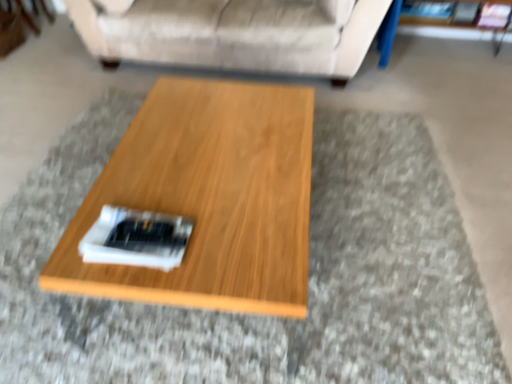
Find the location of a particular element. This screenshot has height=384, width=512. wooden coffee table at center is located at coordinates (208, 199).

What do you see at coordinates (208, 199) in the screenshot? I see `wooden coffee table at center` at bounding box center [208, 199].

In order to face wooden coffee table at center, should I rotate leftwards or rightwards?

Turn left by 5.314 degrees to look at wooden coffee table at center.

The image size is (512, 384). What do you see at coordinates (234, 34) in the screenshot?
I see `beige fabric couch at upper center` at bounding box center [234, 34].

Where is `beige fabric couch at upper center`? beige fabric couch at upper center is located at coordinates pyautogui.click(x=234, y=34).

Where is `wooden coffee table at center`? The width and height of the screenshot is (512, 384). wooden coffee table at center is located at coordinates (208, 199).

Consider the image. Is beige fabric couch at upper center at the right side of wooden coffee table at center?

Incorrect, beige fabric couch at upper center is not on the right side of wooden coffee table at center.

In the image, is beige fabric couch at upper center positioned in front of or behind wooden coffee table at center?

beige fabric couch at upper center is behind wooden coffee table at center.

Which point is more distant from viewer, (100, 13) or (62, 261)?

The point (100, 13) is behind.

From the image's perspective, would you say beige fabric couch at upper center is positioned over wooden coffee table at center?

Yes, from the image's perspective, beige fabric couch at upper center is above wooden coffee table at center.

From a real-world perspective, does beige fabric couch at upper center stand above wooden coffee table at center?

Indeed, from a real-world perspective, beige fabric couch at upper center stands above wooden coffee table at center.

Between beige fabric couch at upper center and wooden coffee table at center, which one has larger width?

With larger width is beige fabric couch at upper center.

Who is taller, beige fabric couch at upper center or wooden coffee table at center?

Standing taller between the two is beige fabric couch at upper center.

Who is bigger, beige fabric couch at upper center or wooden coffee table at center?

beige fabric couch at upper center.

Is beige fabric couch at upper center located outside wooden coffee table at center?

Absolutely, beige fabric couch at upper center is external to wooden coffee table at center.

Would you consider beige fabric couch at upper center to be distant from wooden coffee table at center?

Indeed, beige fabric couch at upper center is not near wooden coffee table at center.

Is wooden coffee table at center at the back of beige fabric couch at upper center?

beige fabric couch at upper center does not have its back to wooden coffee table at center.

Where is `studio couch located above the wooden coffee table at center (from a real-world perspective)`? The width and height of the screenshot is (512, 384). studio couch located above the wooden coffee table at center (from a real-world perspective) is located at coordinates (234, 34).

Between wooden coffee table at center and beige fabric couch at upper center, which one appears on the right side from the viewer's perspective?

wooden coffee table at center.

Is wooden coffee table at center positioned before beige fabric couch at upper center?

Yes, it is in front of beige fabric couch at upper center.

Which is behind, point (217, 272) or point (85, 18)?

Positioned behind is point (85, 18).

From the image's perspective, is wooden coffee table at center located above or below beige fabric couch at upper center?

Based on their image positions, wooden coffee table at center is located beneath beige fabric couch at upper center.

From a real-world perspective, relative to beige fabric couch at upper center, is wooden coffee table at center vertically above or below?

From a real-world perspective, wooden coffee table at center is physically below beige fabric couch at upper center.

Considering the relative sizes of wooden coffee table at center and beige fabric couch at upper center in the image provided, is wooden coffee table at center wider than beige fabric couch at upper center?

No, wooden coffee table at center is not wider than beige fabric couch at upper center.

Considering the sizes of objects wooden coffee table at center and beige fabric couch at upper center in the image provided, who is shorter, wooden coffee table at center or beige fabric couch at upper center?

wooden coffee table at center.

Is wooden coffee table at center bigger or smaller than beige fabric couch at upper center?

wooden coffee table at center is smaller than beige fabric couch at upper center.

Would you say wooden coffee table at center contains beige fabric couch at upper center?

No, wooden coffee table at center does not contain beige fabric couch at upper center.

Is wooden coffee table at center in contact with beige fabric couch at upper center?

No, wooden coffee table at center is not next to beige fabric couch at upper center.

Is wooden coffee table at center oriented away from beige fabric couch at upper center?

No.

I want to click on studio couch on the left of wooden coffee table at center, so click(234, 34).

Locate an element on the screen. coffee table lying in front of the beige fabric couch at upper center is located at coordinates (208, 199).

You are a GUI agent. You are given a task and a screenshot of the screen. Output one action in this format:
    pyautogui.click(x=<x>, y=<y>)
    Task: Click on the studio couch behind the wooden coffee table at center
    
    Given the screenshot: What is the action you would take?
    pyautogui.click(x=234, y=34)